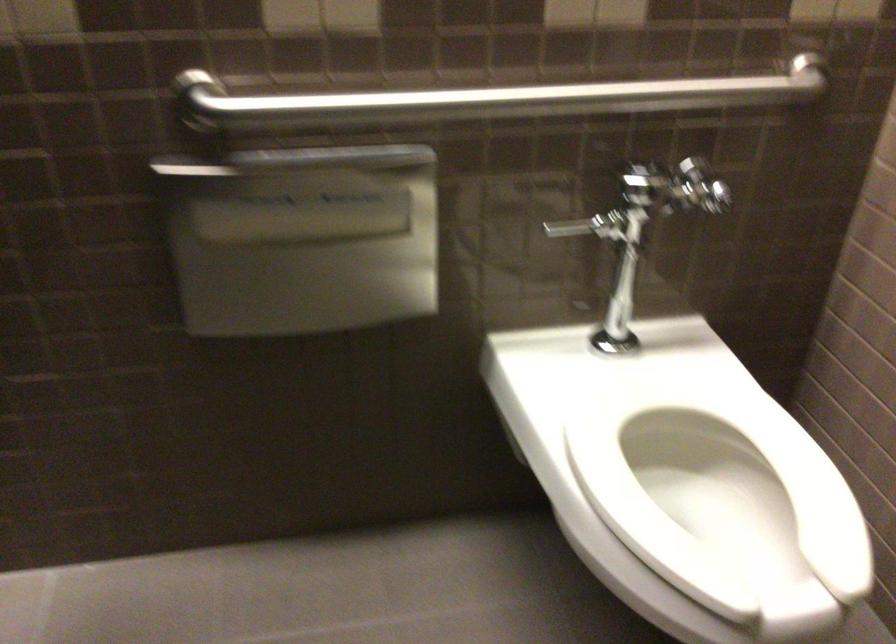
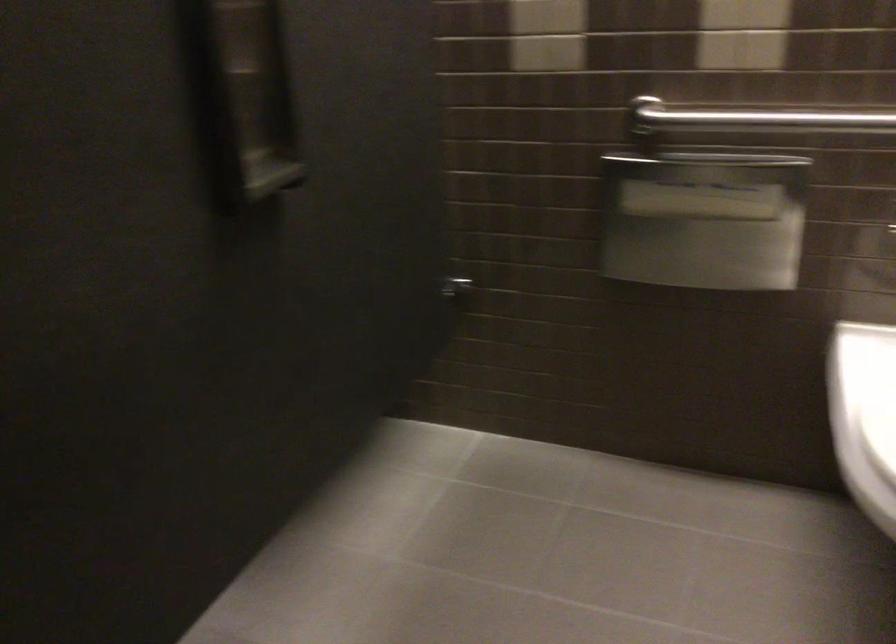
Locate, in the second image, the point that corresponds to point (319, 250) in the first image.

(703, 220)